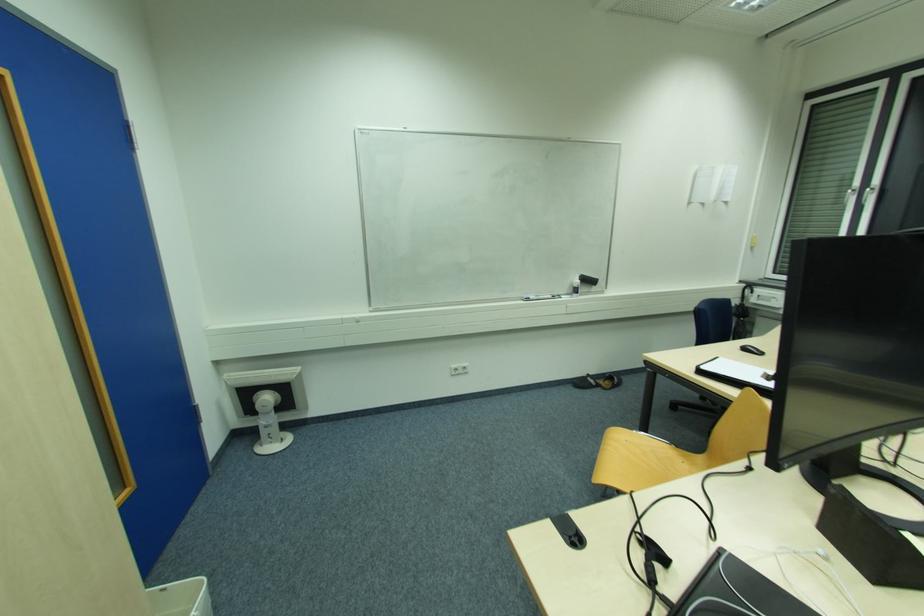
Find where to open the white notebook. Please return your answer as a coordinate pair (x, y).

(737, 374)